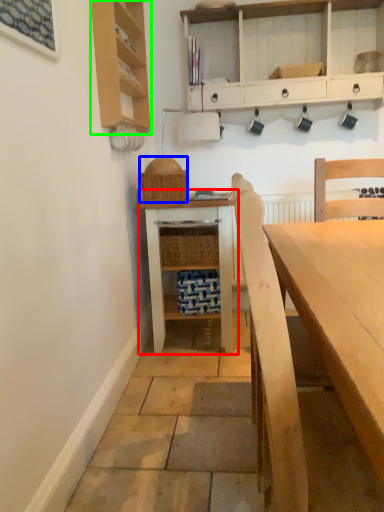
Question: Which object is positioned farthest from table (highlighted by a red box)? Select from picnic basket (highlighted by a blue box) and shelf (highlighted by a green box).

Choices:
 (A) picnic basket
 (B) shelf

Answer: (B)